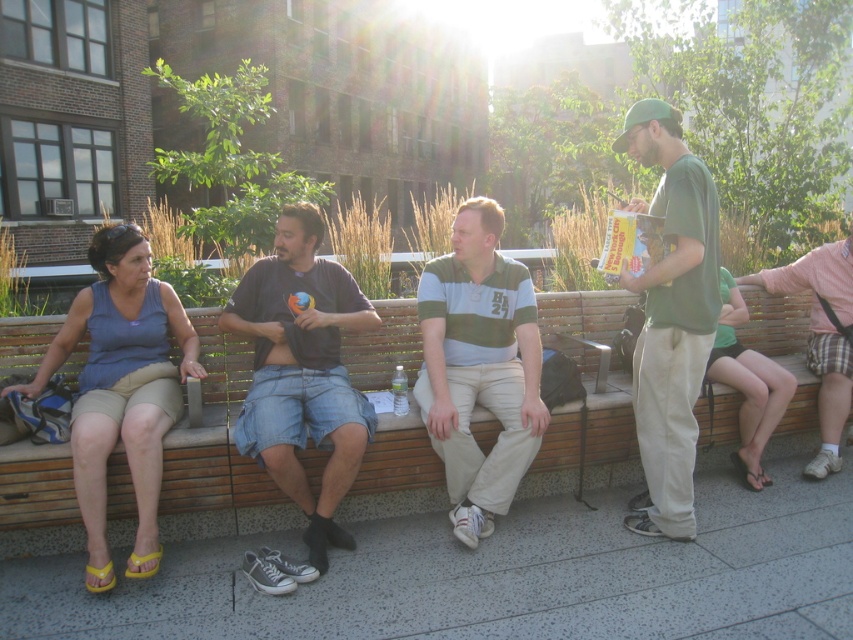
Based on the photo, you are planning to sit on the wooden bench at center but notice the green fabric shorts at right nearby. Based on the scene, can you determine if the bench has enough space for you to sit without overlapping the shorts?

The wooden bench at center might be wider than green fabric shorts at right, so there is a possibility that the bench has enough space for you to sit without overlapping the shorts.

You are standing in the park and want to take a photo of the wooden bench at center. If your camera can focus on objects up to 10 feet away, will it be able to capture the bench clearly?

The wooden bench at center is 9.34 feet away from the camera, which is within the camera focus range of up to 10 feet. Therefore, the camera can capture the bench clearly.